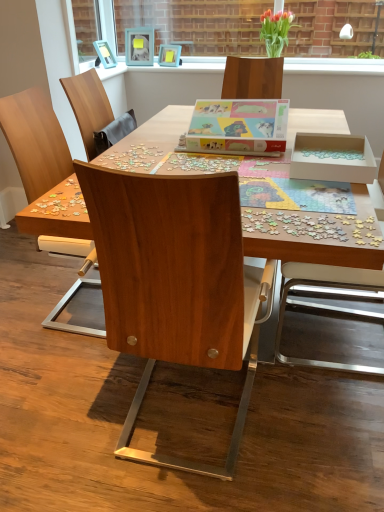
The height and width of the screenshot is (512, 384). I want to click on vacant area situated below wooden chair at center, the second chair in the left-to-right sequence (from a real-world perspective), so click(183, 437).